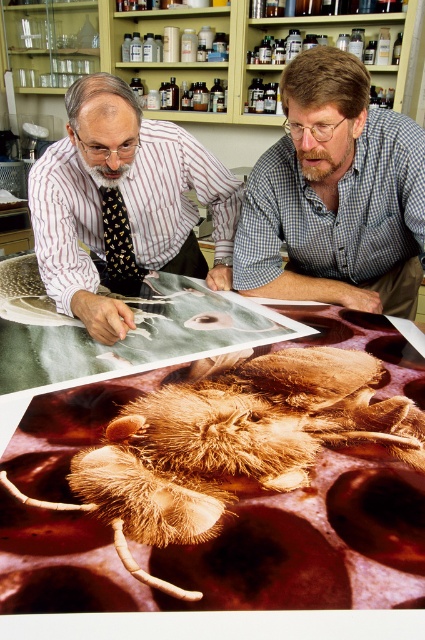
Question: Does brown paper at center appear on the right side of matte black shirt at upper left?

Choices:
 (A) yes
 (B) no

Answer: (A)

Question: Based on their relative distances, which object is nearer to the brown checkered shirt at upper center?

Choices:
 (A) brown paper at center
 (B) matte black shirt at upper left

Answer: (B)

Question: Does brown paper at center have a larger size compared to matte black shirt at upper left?

Choices:
 (A) no
 (B) yes

Answer: (B)

Question: Is brown checkered shirt at upper center to the left of black printed tie at left from the viewer's perspective?

Choices:
 (A) yes
 (B) no

Answer: (B)

Question: Which point appears closest to the camera in this image?

Choices:
 (A) pyautogui.click(x=169, y=128)
 (B) pyautogui.click(x=308, y=54)
 (C) pyautogui.click(x=130, y=257)

Answer: (B)

Question: Which of the following is the closest to the observer?

Choices:
 (A) (322, 342)
 (B) (368, 200)
 (C) (169, 209)

Answer: (A)